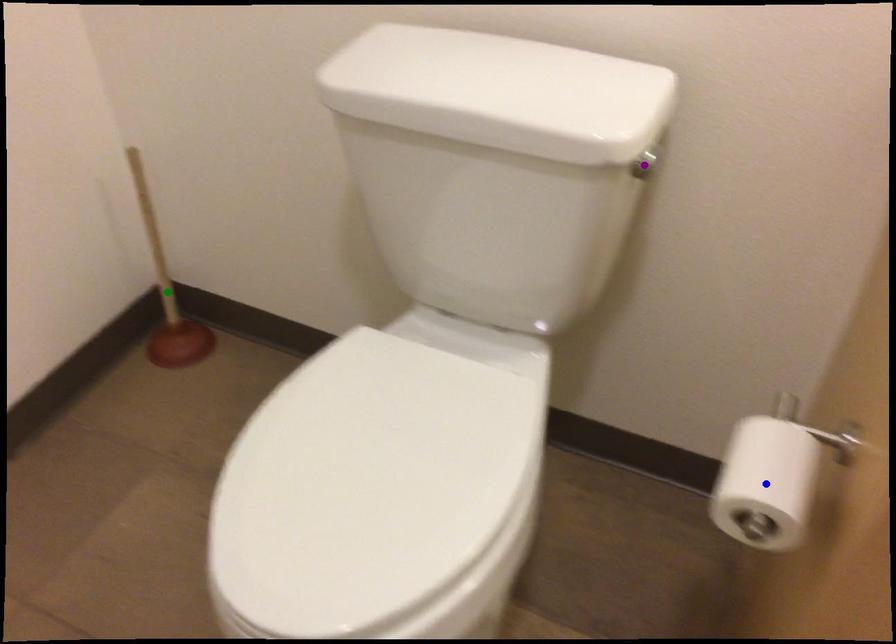
Order these from farthest to nearest:
1. blue point
2. purple point
3. green point

green point < purple point < blue point